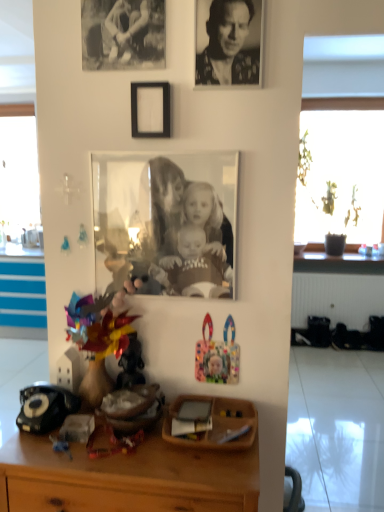
Question: Is black matte picture frame at upper center, the 2th picture frame from the bottom, next to black textured photo at upper center?

Choices:
 (A) yes
 (B) no

Answer: (B)

Question: Considering the relative positions of black matte picture frame at upper center, the second picture frame when ordered from top to bottom, and black textured photo at upper center in the image provided, is black matte picture frame at upper center, the second picture frame when ordered from top to bottom, to the right of black textured photo at upper center from the viewer's perspective?

Choices:
 (A) yes
 (B) no

Answer: (B)

Question: From a real-world perspective, does black matte picture frame at upper center, the 2th picture frame from the bottom, sit lower than black textured photo at upper center?

Choices:
 (A) no
 (B) yes

Answer: (B)

Question: Considering the relative positions of black matte picture frame at upper center, the second picture frame when ordered from top to bottom, and black textured photo at upper center in the image provided, is black matte picture frame at upper center, the second picture frame when ordered from top to bottom, in front of black textured photo at upper center?

Choices:
 (A) yes
 (B) no

Answer: (B)

Question: Is black matte picture frame at upper center, the 2th picture frame from the bottom, further to camera compared to black textured photo at upper center?

Choices:
 (A) yes
 (B) no

Answer: (A)

Question: Considering the positions of black paper at upper left, which appears as the 1th picture frame when viewed from the top, and black textured photo at upper center in the image, is black paper at upper left, which appears as the 1th picture frame when viewed from the top, wider or thinner than black textured photo at upper center?

Choices:
 (A) wide
 (B) thin

Answer: (B)

Question: From a real-world perspective, is black paper at upper left, which appears as the 1th picture frame when viewed from the top, positioned above or below black textured photo at upper center?

Choices:
 (A) above
 (B) below

Answer: (A)

Question: Is black paper at upper left, which appears as the 1th picture frame when viewed from the top, bigger or smaller than black textured photo at upper center?

Choices:
 (A) small
 (B) big

Answer: (B)

Question: Visually, is black paper at upper left, the 3th picture frame when ordered from bottom to top, positioned to the left or to the right of black textured photo at upper center?

Choices:
 (A) left
 (B) right

Answer: (A)

Question: From the image's perspective, is shiny metallic figurine at center, marked as the second toy in a right-to-left arrangement, located above or below matte glass photo frame at center, positioned as the third picture frame in top-to-bottom order?

Choices:
 (A) above
 (B) below

Answer: (B)

Question: Relative to matte glass photo frame at center, placed as the 1th picture frame when sorted from bottom to top, is shiny metallic figurine at center, marked as the second toy in a right-to-left arrangement, in front or behind?

Choices:
 (A) front
 (B) behind

Answer: (B)

Question: From a real-world perspective, is shiny metallic figurine at center, the 2th toy in the left-to-right sequence, above or below matte glass photo frame at center, placed as the 1th picture frame when sorted from bottom to top?

Choices:
 (A) above
 (B) below

Answer: (B)

Question: Considering the positions of shiny metallic figurine at center, the 2th toy in the left-to-right sequence, and matte glass photo frame at center, positioned as the third picture frame in top-to-bottom order, in the image, is shiny metallic figurine at center, the 2th toy in the left-to-right sequence, bigger or smaller than matte glass photo frame at center, positioned as the third picture frame in top-to-bottom order,?

Choices:
 (A) big
 (B) small

Answer: (B)

Question: In the image, is wooden desk at center positioned in front of or behind multicolored plastic toy at lower center, which is the first toy in right-to-left order?

Choices:
 (A) front
 (B) behind

Answer: (A)

Question: From the image's perspective, is wooden desk at center located above or below multicolored plastic toy at lower center, which is the first toy in right-to-left order?

Choices:
 (A) above
 (B) below

Answer: (B)